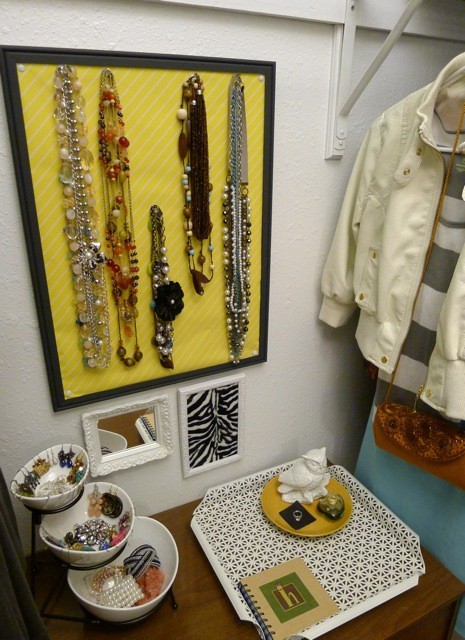
You are a GUI agent. You are given a task and a screenshot of the screen. Output one action in this format:
    pyautogui.click(x=<x>, y=<y>)
    Task: Click on the wall
    The width and height of the screenshot is (465, 640).
    Given the screenshot: What is the action you would take?
    pyautogui.click(x=297, y=374)